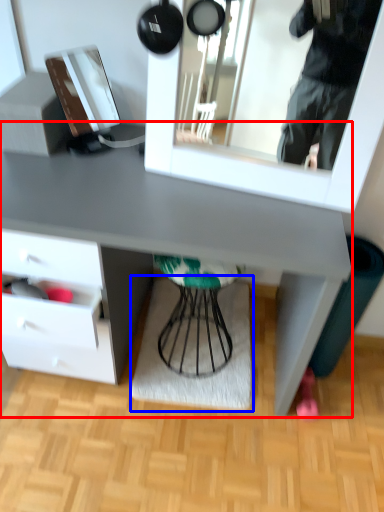
Question: Which object is further to the camera taking this photo, desk (highlighted by a red box) or mat (highlighted by a blue box)?

Choices:
 (A) desk
 (B) mat

Answer: (B)